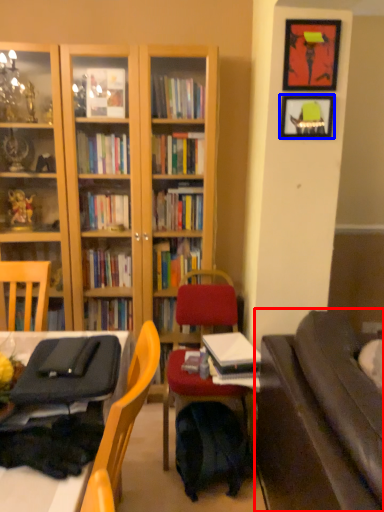
Question: Which point is closer to the camera, studio couch (highlighted by a red box) or picture frame (highlighted by a blue box)?

Choices:
 (A) studio couch
 (B) picture frame

Answer: (A)